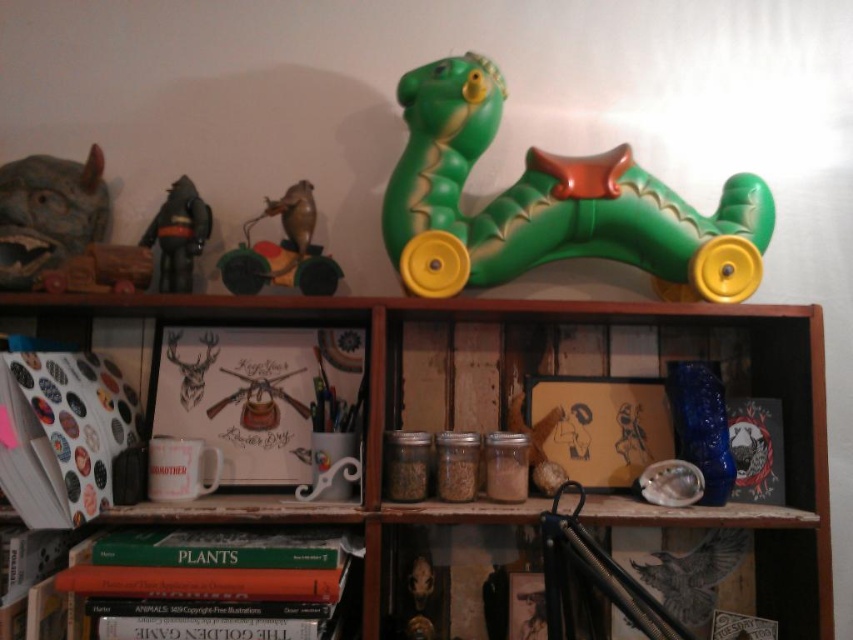
Question: Can you confirm if green plastic toy at upper center is positioned to the right of green matte book at lower left?

Choices:
 (A) yes
 (B) no

Answer: (A)

Question: Among these points, which one is farthest from the camera?

Choices:
 (A) (103, 284)
 (B) (39, 154)

Answer: (B)

Question: Is wooden bookcase at upper center to the right of wooden wagon at left from the viewer's perspective?

Choices:
 (A) no
 (B) yes

Answer: (B)

Question: Which of the following is the farthest from the observer?

Choices:
 (A) matte gray mask at upper left
 (B) green plastic toy at upper center
 (C) green matte book at lower left
 (D) green rubber toy at upper center

Answer: (D)

Question: Estimate the real-world distances between objects in this image. Which object is farther from the green matte book at lower left?

Choices:
 (A) green plastic toy at upper center
 (B) green rubber toy at upper center
 (C) matte gray mask at upper left

Answer: (A)

Question: Is matte gray mask at upper left below metallic silver figure at left?

Choices:
 (A) yes
 (B) no

Answer: (B)